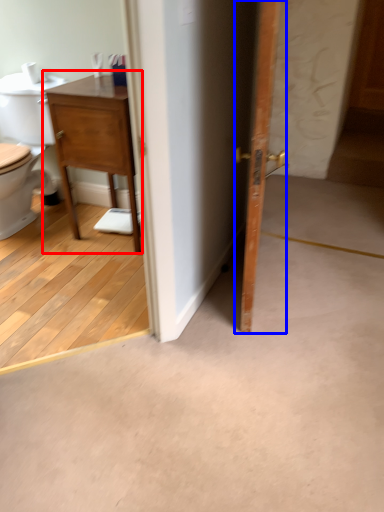
Question: Which point is further to the camera, nightstand (highlighted by a red box) or door (highlighted by a blue box)?

Choices:
 (A) nightstand
 (B) door

Answer: (A)